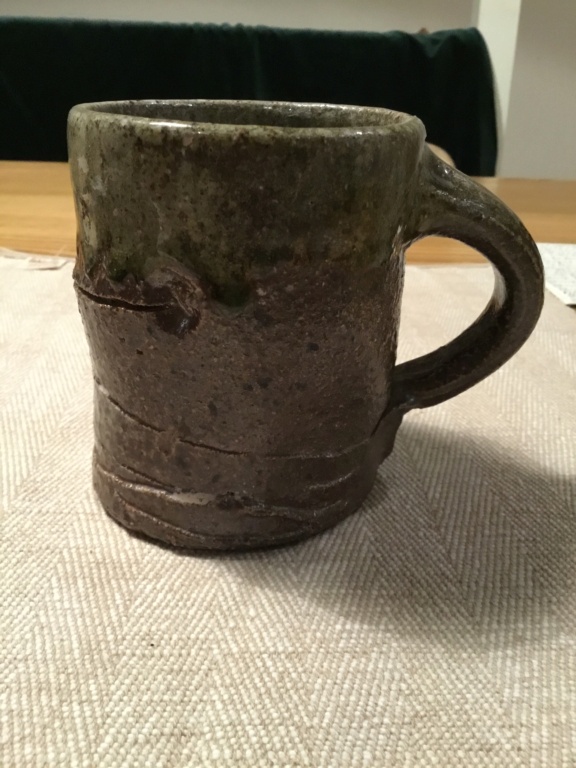
Identify the location of empty space on table. (41, 194).